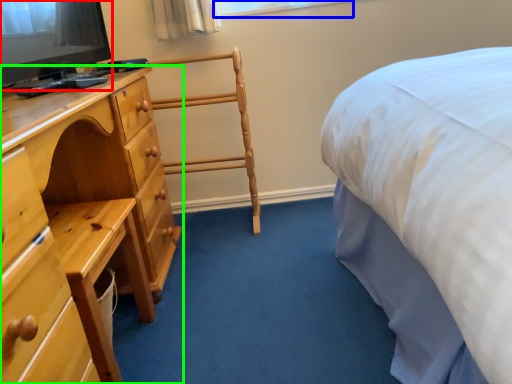
Question: Based on their relative distances, which object is nearer to television (highlighted by a red box)? Choose from window (highlighted by a blue box) and chest of drawers (highlighted by a green box).

Choices:
 (A) window
 (B) chest of drawers

Answer: (B)